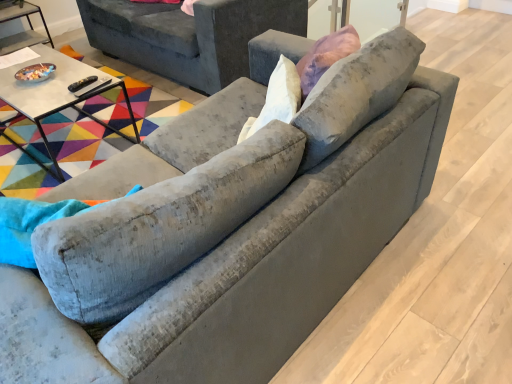
Question: From the image's perspective, would you say matte glass bowl at left, which is counted as the 1th table, starting from the left, is shown under white glossy table at upper left, the 2th table when ordered from top to bottom?

Choices:
 (A) no
 (B) yes

Answer: (A)

Question: Does matte glass bowl at left, the second table from the bottom, have a larger size compared to white glossy table at upper left, marked as the 2th table in a left-to-right arrangement?

Choices:
 (A) no
 (B) yes

Answer: (A)

Question: Is matte glass bowl at left, which is counted as the second table, starting from the right, far from white glossy table at upper left, the 2th table when ordered from top to bottom?

Choices:
 (A) no
 (B) yes

Answer: (B)

Question: From a real-world perspective, is matte glass bowl at left, which is counted as the second table, starting from the right, over white glossy table at upper left, marked as the 2th table in a left-to-right arrangement?

Choices:
 (A) no
 (B) yes

Answer: (A)

Question: Is matte glass bowl at left, which is counted as the second table, starting from the right, thinner than white glossy table at upper left, the 2th table when ordered from top to bottom?

Choices:
 (A) yes
 (B) no

Answer: (A)

Question: From a real-world perspective, is velvet gray couch at upper center physically located above or below matte glass bowl at left, the second table from the bottom?

Choices:
 (A) below
 (B) above

Answer: (B)

Question: From the image's perspective, relative to matte glass bowl at left, positioned as the 1th table in top-to-bottom order, is velvet gray couch at upper center above or below?

Choices:
 (A) above
 (B) below

Answer: (A)

Question: Considering the positions of velvet gray couch at upper center and matte glass bowl at left, which is counted as the 1th table, starting from the left, in the image, is velvet gray couch at upper center bigger or smaller than matte glass bowl at left, which is counted as the 1th table, starting from the left,?

Choices:
 (A) big
 (B) small

Answer: (A)

Question: Based on their positions, is velvet gray couch at upper center located to the left or right of matte glass bowl at left, positioned as the 1th table in top-to-bottom order?

Choices:
 (A) right
 (B) left

Answer: (A)

Question: From the image's perspective, is velvet gray swivel chair at left located above or below velvet gray couch at upper center?

Choices:
 (A) above
 (B) below

Answer: (B)

Question: In the image, is velvet gray swivel chair at left positioned in front of or behind velvet gray couch at upper center?

Choices:
 (A) front
 (B) behind

Answer: (A)

Question: In terms of size, does velvet gray swivel chair at left appear bigger or smaller than velvet gray couch at upper center?

Choices:
 (A) small
 (B) big

Answer: (A)

Question: Is velvet gray swivel chair at left inside or outside of velvet gray couch at upper center?

Choices:
 (A) inside
 (B) outside

Answer: (B)

Question: Is velvet gray swivel chair at left inside the boundaries of matte glass bowl at left, which is counted as the second table, starting from the right, or outside?

Choices:
 (A) inside
 (B) outside

Answer: (B)

Question: Would you say velvet gray swivel chair at left is to the left or to the right of matte glass bowl at left, the second table from the bottom, in the picture?

Choices:
 (A) left
 (B) right

Answer: (B)